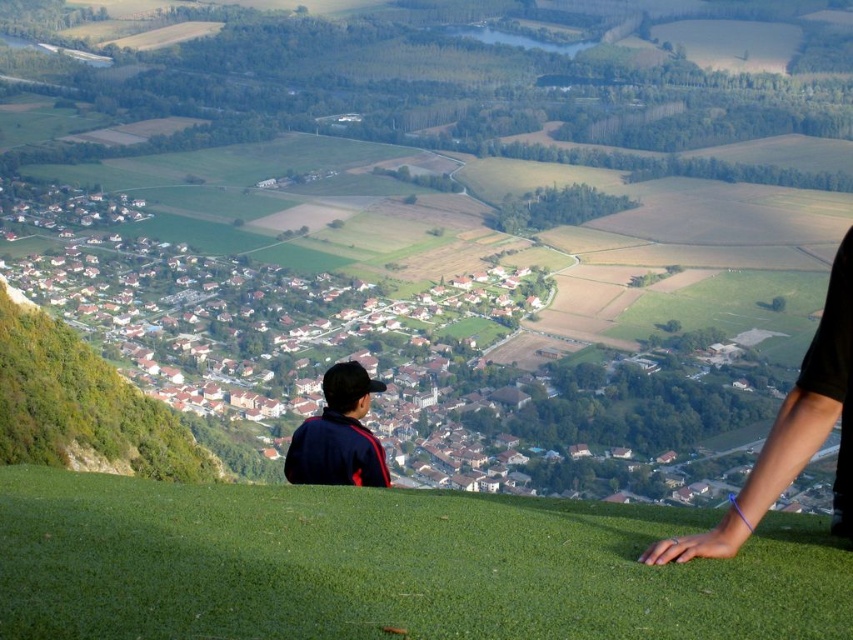
You are standing at the top of a hill and see the green grassy at lower center and the dark blue jacket at center. Which object is located to the right side from your viewpoint?

The green grassy at lower center is located to the right of the dark blue jacket at center.

You are a photographer trying to capture the scene with a wide angle lens. The green grassy at lower center and the dark blue jacket at center are both in your frame. Which object appears smaller in your photo?

The green grassy at lower center appears smaller in the photo because it is described as smaller than the dark blue jacket at center.